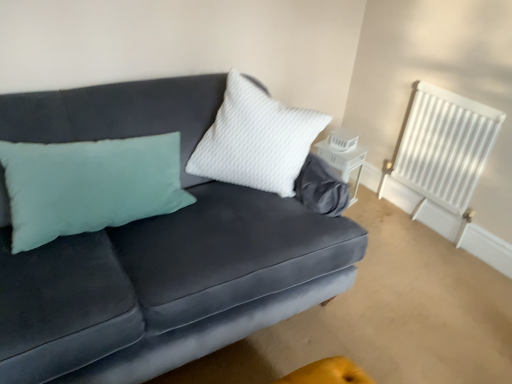
The image size is (512, 384). In order to click on vacant space underneath white painted metal radiator at upper right (from a real-world perspective) in this screenshot , I will do `click(413, 217)`.